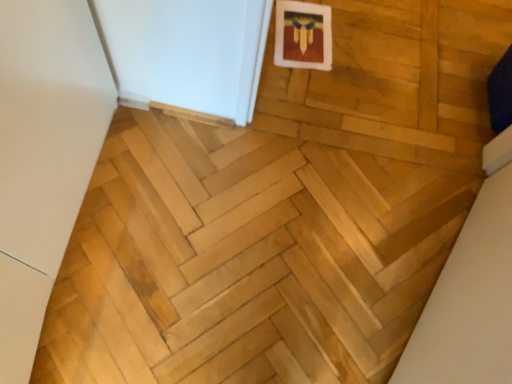
You are a GUI agent. You are given a task and a screenshot of the screen. Output one action in this format:
    pyautogui.click(x=<x>, y=<y>)
    Task: Click on the empty space that is ontop of wooden picture frame at upper center
    
    Given the screenshot: What is the action you would take?
    pyautogui.click(x=303, y=34)